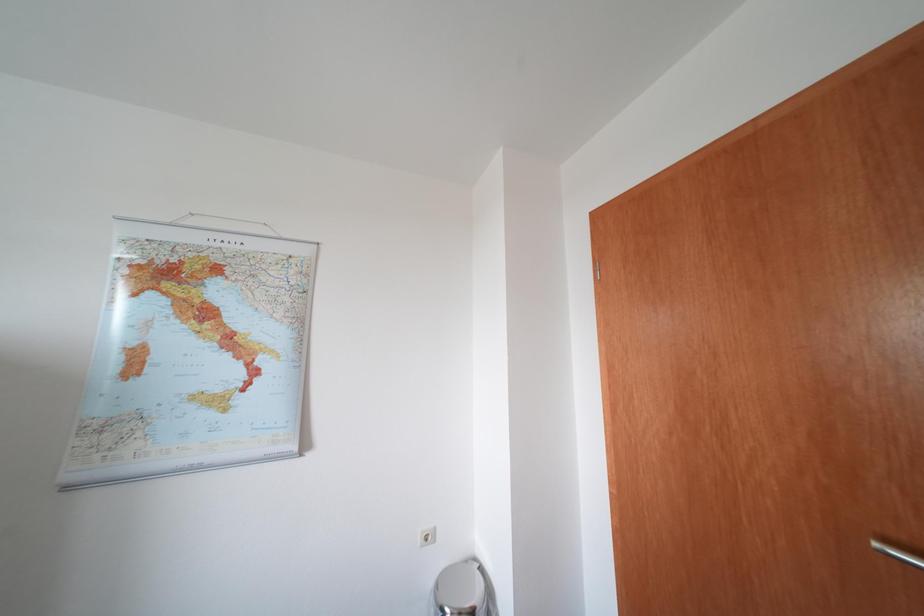
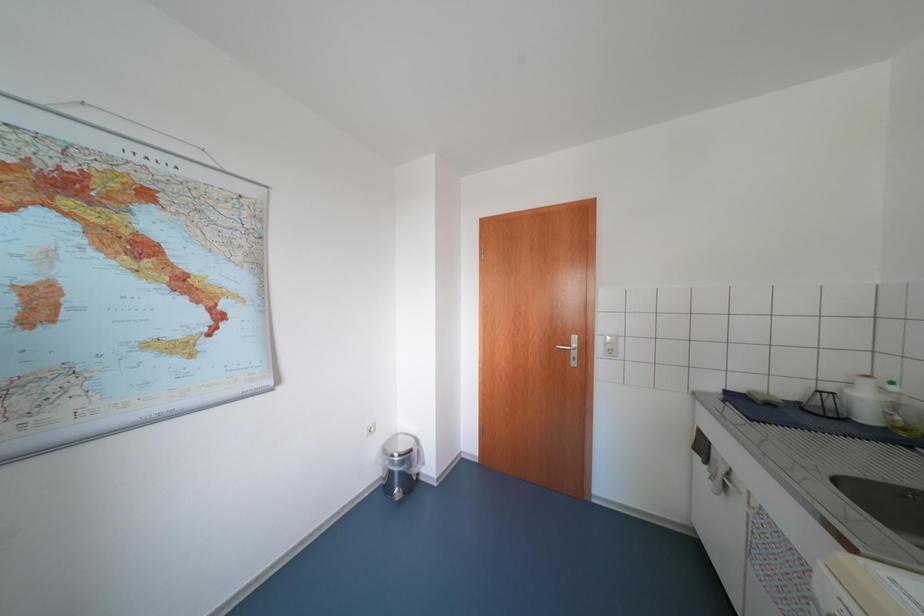
Question: The images are taken continuously from a first-person perspective. In which direction is your viewpoint rotating?

Choices:
 (A) Left
 (B) Right
 (C) Up
 (D) Down

Answer: (B)